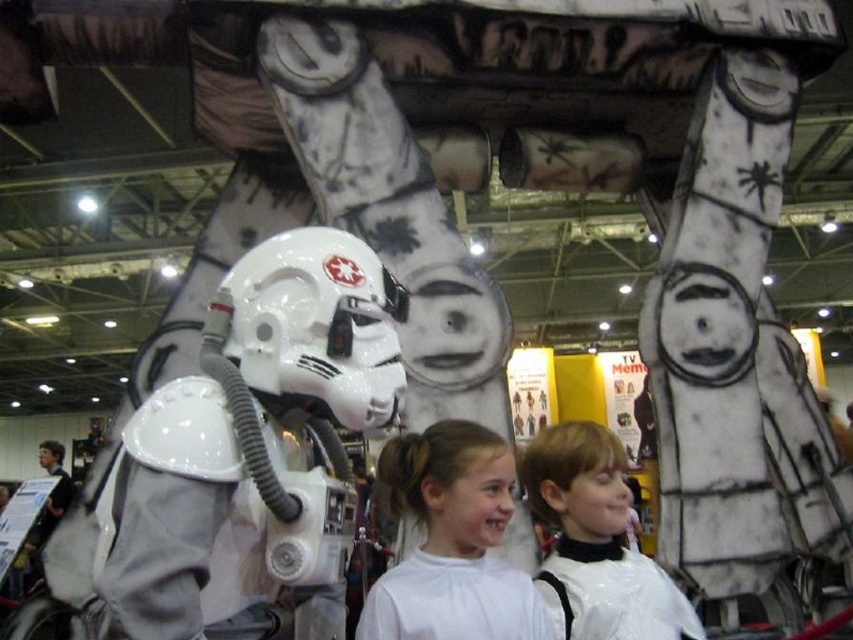
You are a photographer at the event and need to ensure that both the white matte shirt at center and the white glossy hair at center are visible in your photo. Since the camera has a limited focus range, which object should you prioritize focusing on to ensure it stays in frame given their sizes?

The white glossy hair at center is wider than the white matte shirt at center, so focusing on the wider object ensures it stays in frame.

You are a photographer at the event and want to ensure that both the white matte shirt at center and the white glossy hair at center are visible in your photo. Since the lighting is tricky, you need to adjust your camera settings. Which object requires more light to appear properly in the photo?

The white glossy hair at center requires more light because it is larger in size than the white matte shirt at center, making it harder to capture details in low light.